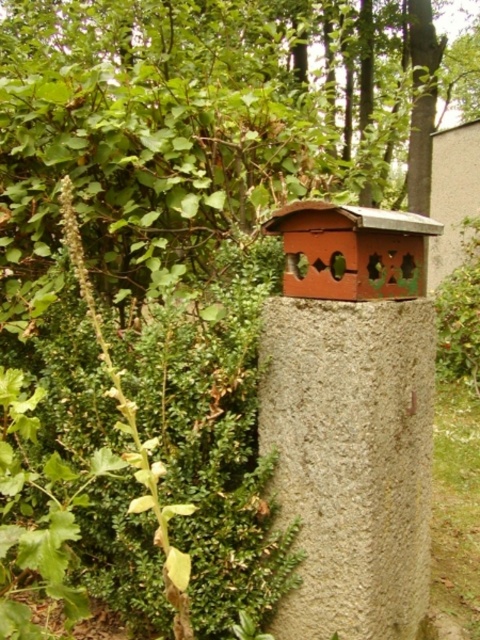
Question: In this image, where is green leafy tree at upper left located relative to gray concrete post at center?

Choices:
 (A) right
 (B) left

Answer: (B)

Question: Which of the following is the closest to the observer?

Choices:
 (A) (261, 28)
 (B) (402, 600)

Answer: (B)

Question: Can you confirm if green leafy tree at upper left is positioned below gray concrete post at center?

Choices:
 (A) yes
 (B) no

Answer: (B)

Question: Is green leafy tree at upper left to the right of gray concrete post at center from the viewer's perspective?

Choices:
 (A) no
 (B) yes

Answer: (A)

Question: Which of the following is the closest to the observer?

Choices:
 (A) gray concrete post at center
 (B) green leafy tree at upper left

Answer: (A)